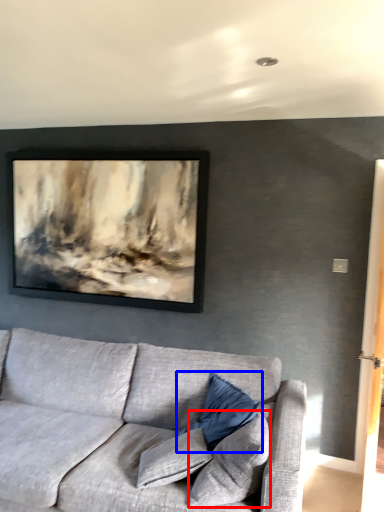
Question: Which of the following is the farthest to the observer, pillow (highlighted by a red box) or pillow (highlighted by a blue box)?

Choices:
 (A) pillow
 (B) pillow

Answer: (B)